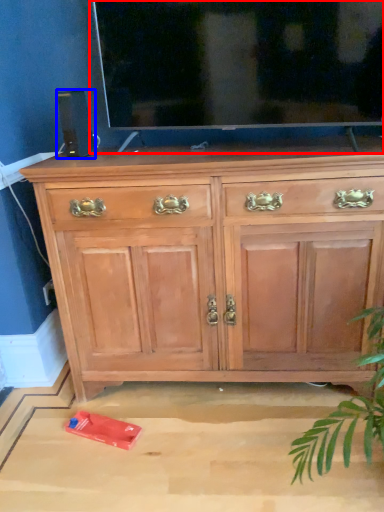
Question: Which object appears closest to the camera in this image, glass door (highlighted by a red box) or speaker (highlighted by a blue box)?

Choices:
 (A) glass door
 (B) speaker

Answer: (A)